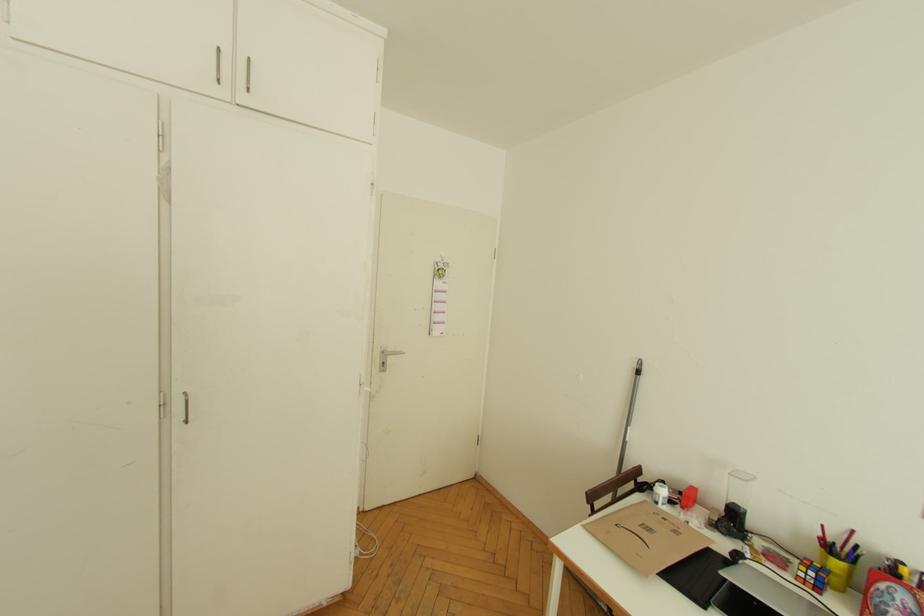
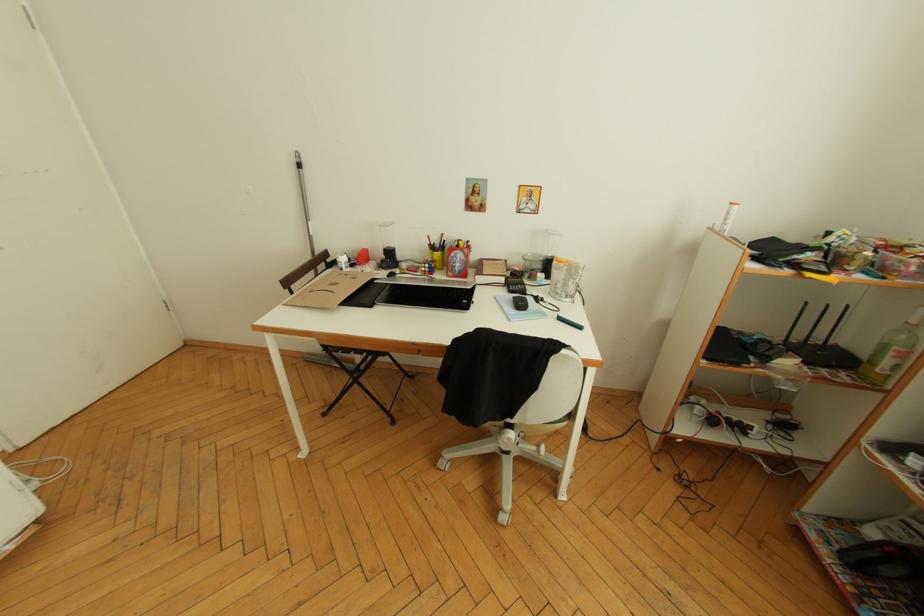
First-person continuous shooting, in which direction is the camera rotating?

The camera rotated toward right-down.